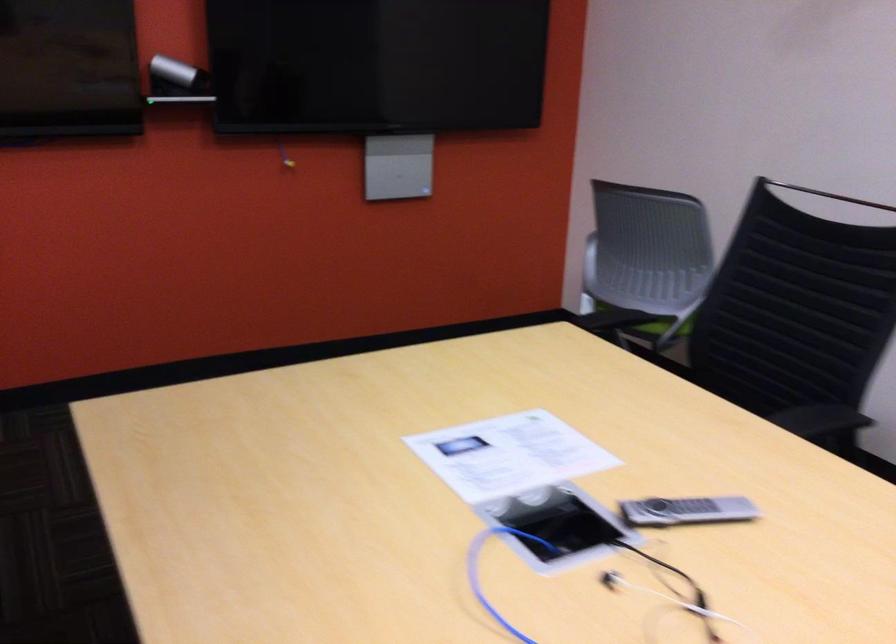
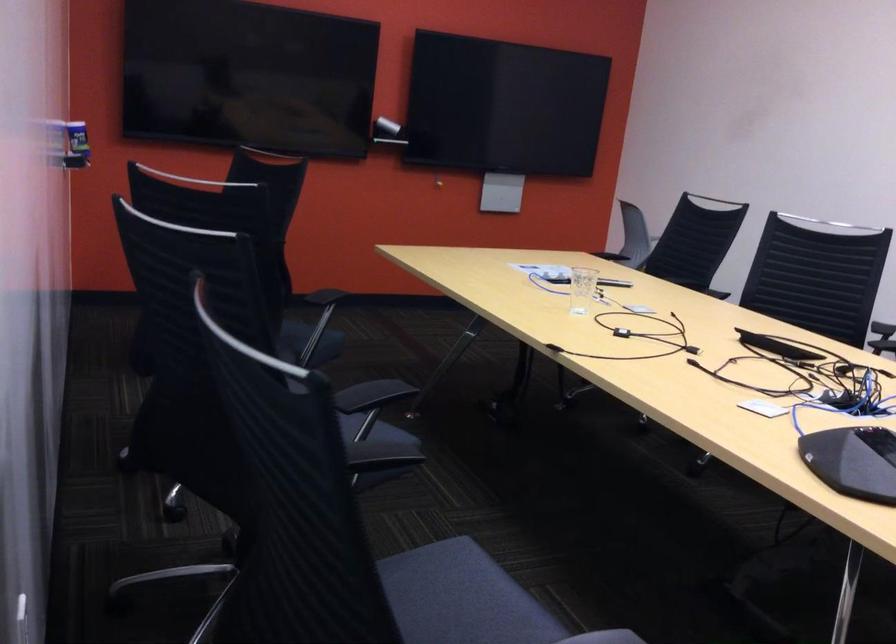
Question: What movement of the cameraman would produce the second image?

Choices:
 (A) Left
 (B) Right
 (C) Forward
 (D) Backward

Answer: (D)